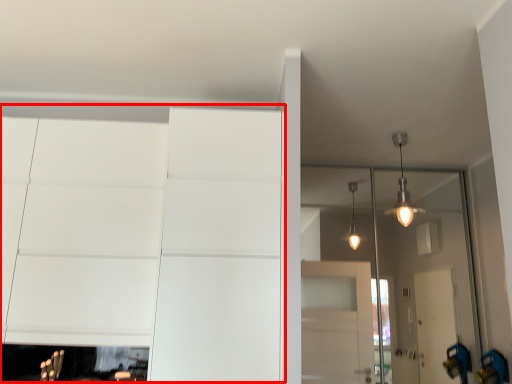
Question: In this image, where is dresser (annotated by the red box) located relative to glass door?

Choices:
 (A) right
 (B) left

Answer: (B)